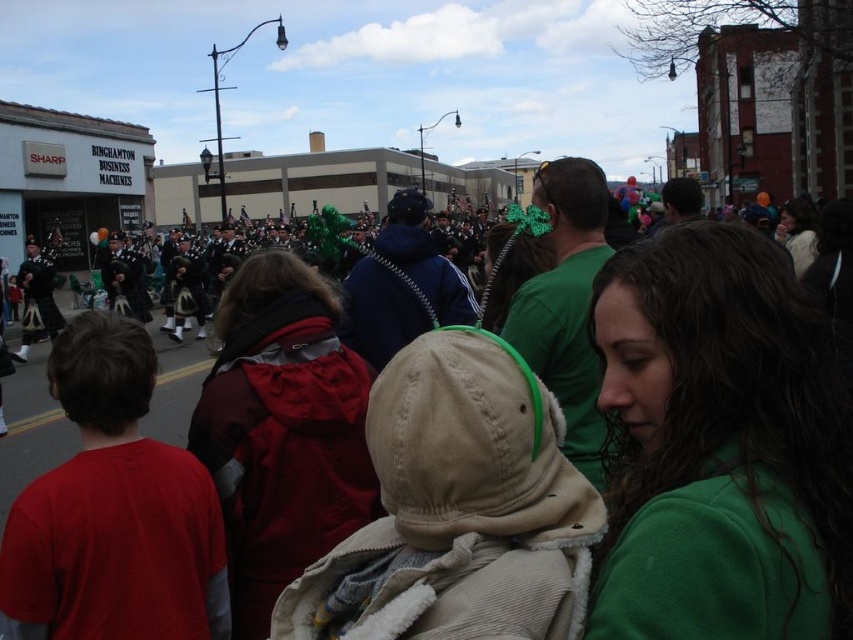
Image resolution: width=853 pixels, height=640 pixels. Describe the element at coordinates (718, 445) in the screenshot. I see `green fleece jacket at center` at that location.

Who is more distant from viewer, [839,547] or [137,516]?

Positioned behind is point [137,516].

I want to click on green fleece jacket at center, so click(x=718, y=445).

Is point (804, 488) farther from camera compared to point (3, 497)?

No, (804, 488) is in front of (3, 497).

The width and height of the screenshot is (853, 640). What are the coordinates of `green fleece jacket at center` in the screenshot? It's located at (718, 445).

Which of these two, red cotton shirt at center or matte green hat at center, stands taller?

matte green hat at center

This screenshot has height=640, width=853. I want to click on red cotton shirt at center, so click(x=113, y=509).